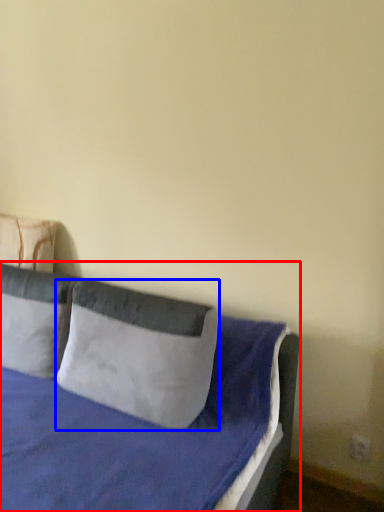
Question: Which point is further to the camera, bed (highlighted by a red box) or pillow (highlighted by a blue box)?

Choices:
 (A) bed
 (B) pillow

Answer: (B)